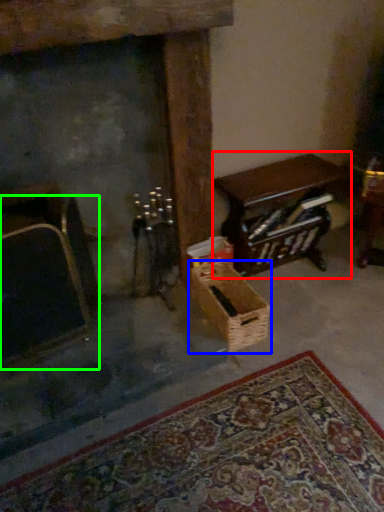
Question: Which is nearer to the table (highlighted by a red box)? basket (highlighted by a blue box) or armchair (highlighted by a green box).

Choices:
 (A) basket
 (B) armchair

Answer: (A)